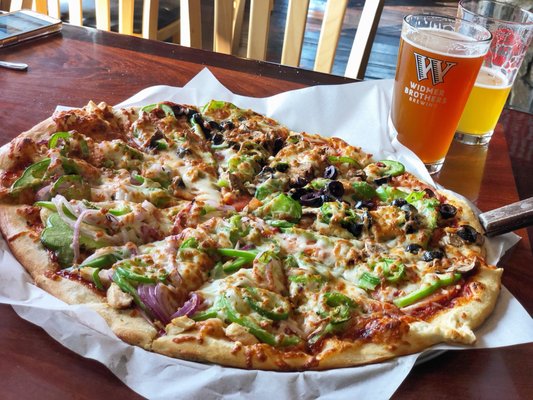
Locate an element on the screen. This screenshot has width=533, height=400. napkins is located at coordinates (306, 390), (357, 117), (20, 294), (500, 327), (193, 96).